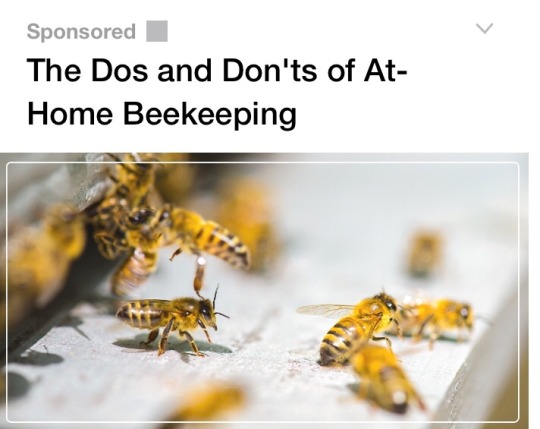
Where is `floor`? floor is located at coordinates (502, 409).